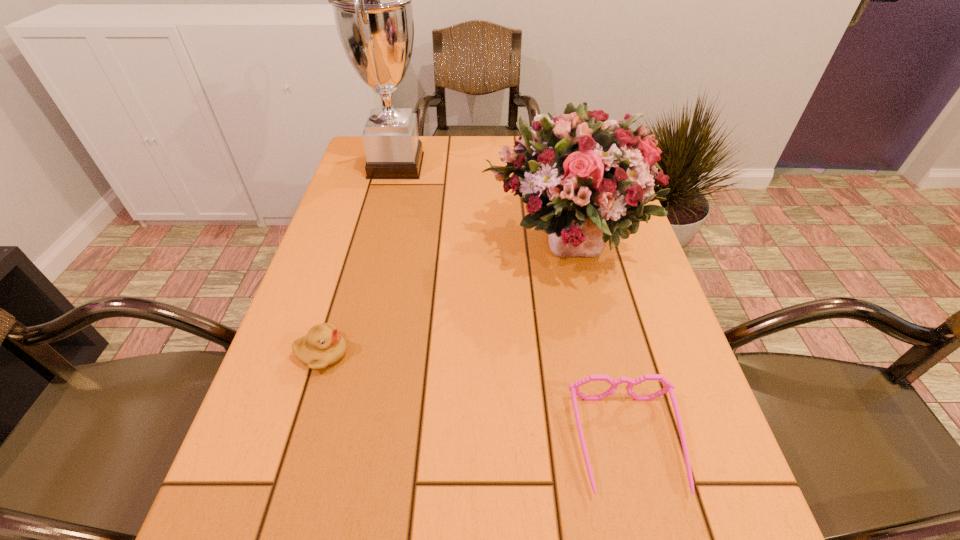
Locate an element on the screen. The width and height of the screenshot is (960, 540). blank region between the tallest object and the third tallest object is located at coordinates (468, 161).

This screenshot has width=960, height=540. Find the location of `free space between the nearest object and the beer can`. free space between the nearest object and the beer can is located at coordinates (585, 301).

Where is `free space between the spectacles and the third tallest object`? This screenshot has height=540, width=960. free space between the spectacles and the third tallest object is located at coordinates point(585,301).

At what (x,y) coordinates should I click in order to perform the action: click on free space between the duckling and the tallest object. Please return your answer as a coordinate pair (x, y). The image size is (960, 540). Looking at the image, I should click on (359, 260).

Where is `vacant space in between the beer can and the duckling`? The image size is (960, 540). vacant space in between the beer can and the duckling is located at coordinates (432, 256).

The height and width of the screenshot is (540, 960). What are the coordinates of `free point between the third nearest object and the fourth farthest object` in the screenshot? It's located at (443, 299).

Image resolution: width=960 pixels, height=540 pixels. What are the coordinates of `unoccupied area between the trophy cup and the duckling` in the screenshot? It's located at (359, 260).

Where is `object that is the second closest to the beer can`? object that is the second closest to the beer can is located at coordinates (371, 0).

What are the coordinates of `object that stands as the third closest to the tallest object` in the screenshot? It's located at (323, 346).

This screenshot has width=960, height=540. Identify the location of free location that satisfies the following two spatial constraints: 1. at the front view of the tallest object; 2. on the left side of the third farthest object. (376, 243).